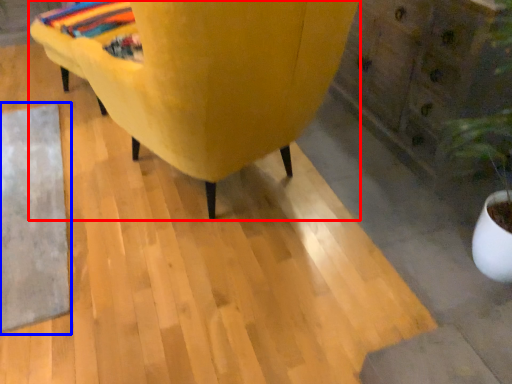
Question: Which of the following is the closest to the observer, furniture (highlighted by a red box) or mat (highlighted by a blue box)?

Choices:
 (A) furniture
 (B) mat

Answer: (A)